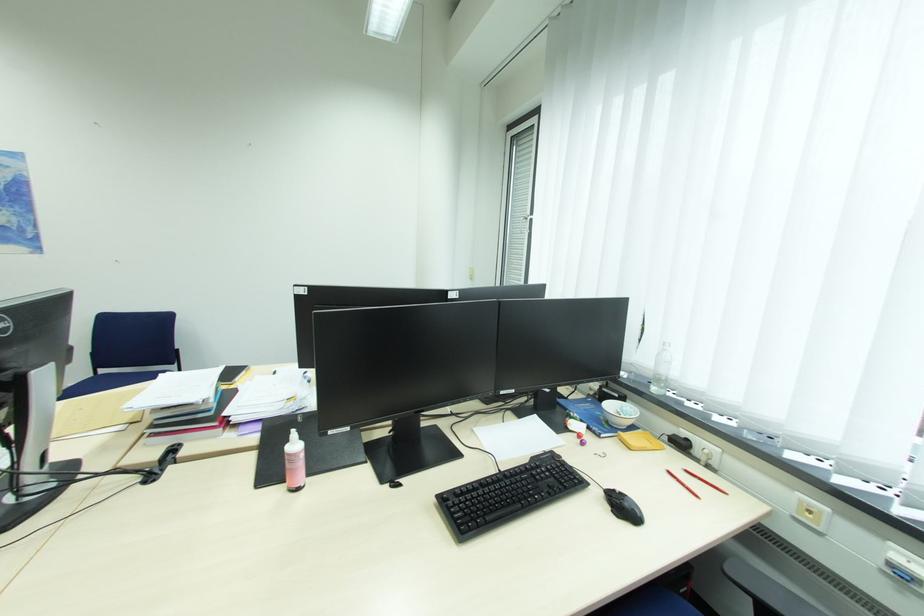
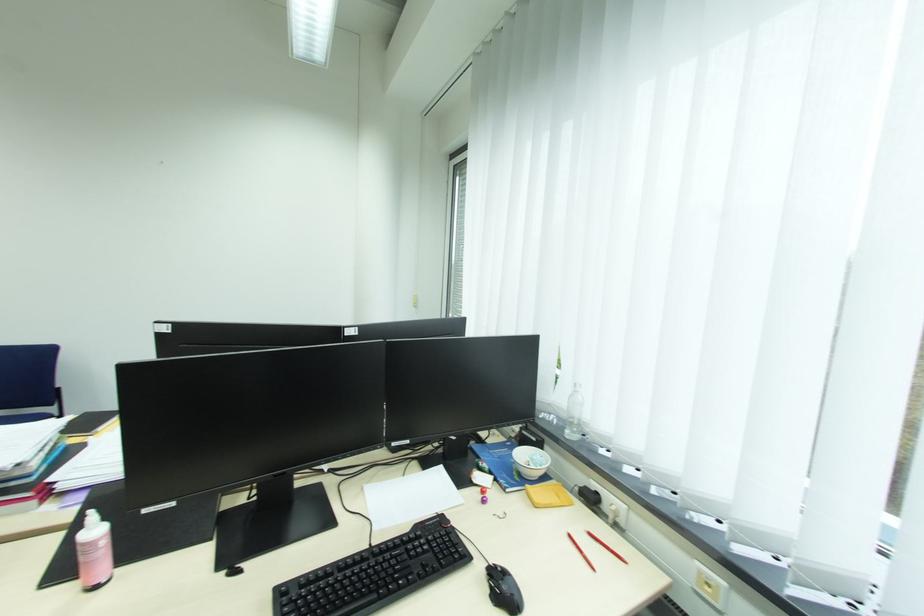
Question: Which direction would the cameraman need to move to produce the second image? Reply with the corresponding letter.

Choices:
 (A) Left
 (B) Right
 (C) Forward
 (D) Backward

Answer: (B)